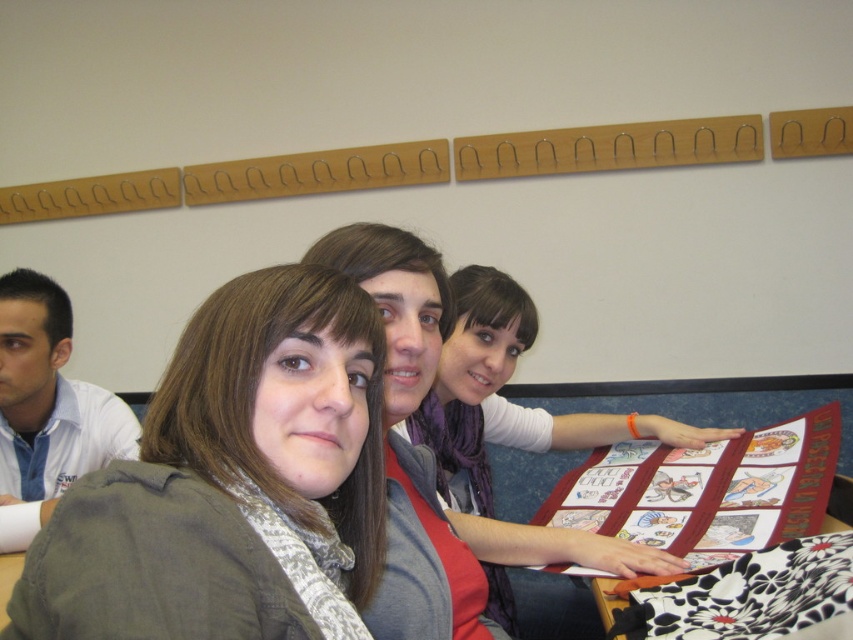
You are standing in front of the table where the group is seated. You notice a specific point on the table marked at coordinates (231, 481). What object is located at that exact point?

The object at point (231, 481) is the matte gray jacket at center.

You are organizing a classroom and need to place the matte red book at center and the red fabric quilt at center on a shelf. Based on their positions in the image, which object should you place on the top shelf?

The matte red book at center should be placed on the top shelf since it is located above the red fabric quilt at center in the image.

You are a photographer trying to capture a closeup of the matte gray scarf at center without including the matte gray jacket at center in the frame. Is this possible given their positions?

The matte gray jacket at center is above the matte gray scarf at center, so if you position your camera below the jacket and aim upwards towards the scarf, you can capture the scarf without the jacket in the frame.